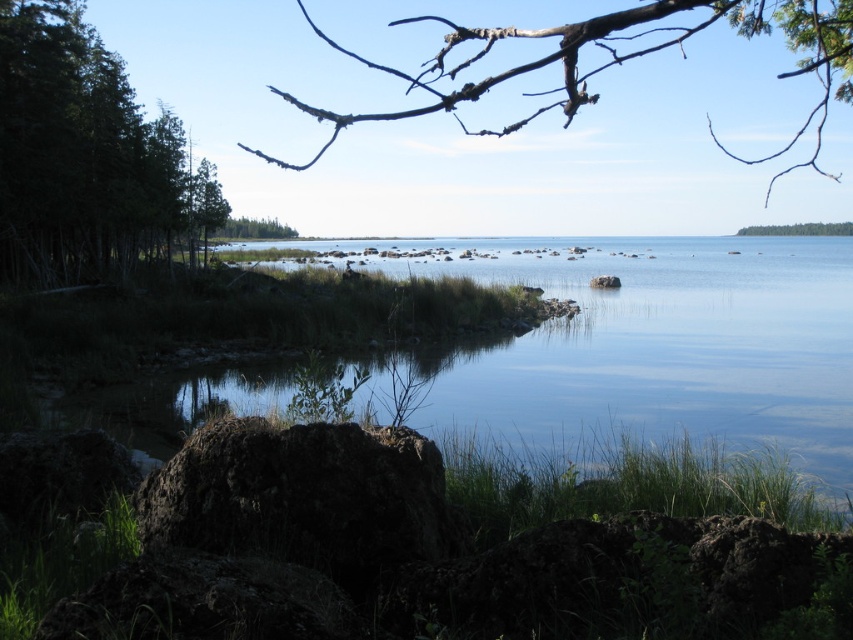
Is point (819, 305) farther from viewer compared to point (73, 230)?

Yes, point (819, 305) is behind point (73, 230).

Does point (148, 435) lie behind point (10, 65)?

No, it is not.

This screenshot has height=640, width=853. Find the location of `clear water at center`. clear water at center is located at coordinates (647, 364).

Can you confirm if clear water at center is smaller than brown/dry wood branches at upper center?

Indeed, clear water at center has a smaller size compared to brown/dry wood branches at upper center.

Is clear water at center thinner than brown/dry wood branches at upper center?

Correct, clear water at center's width is less than brown/dry wood branches at upper center's.

Which is in front, point (664, 456) or point (459, 33)?

Point (459, 33) is in front.

Locate an element on the screen. The width and height of the screenshot is (853, 640). clear water at center is located at coordinates (647, 364).

Does rusty metallic rock at lower center lie in front of brown/dry wood branches at upper center?

That is False.

Does rusty metallic rock at lower center appear over brown/dry wood branches at upper center?

Actually, rusty metallic rock at lower center is below brown/dry wood branches at upper center.

Where is `rusty metallic rock at lower center`? The image size is (853, 640). rusty metallic rock at lower center is located at coordinates (300, 496).

The width and height of the screenshot is (853, 640). Find the location of `rusty metallic rock at lower center`. rusty metallic rock at lower center is located at coordinates (300, 496).